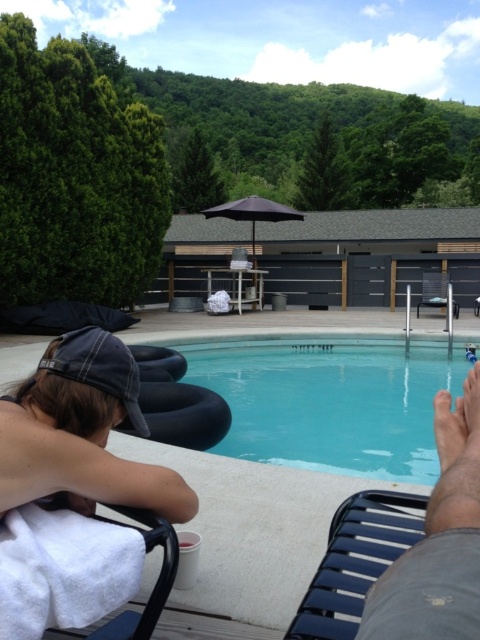
Question: Is black plastic chair at lower right wider than metallic silver chair at center?

Choices:
 (A) yes
 (B) no

Answer: (B)

Question: Observing the image, what is the correct spatial positioning of white fabric chair at lower left in reference to smooth skin foot at lower right?

Choices:
 (A) above
 (B) below

Answer: (B)

Question: Among these points, which one is farthest from the camera?

Choices:
 (A) (12, 451)
 (B) (332, 529)
 (C) (321, 333)

Answer: (C)

Question: Among these objects, which one is nearest to the camera?

Choices:
 (A) metallic silver chair at center
 (B) blue smooth water at center

Answer: (B)

Question: Does smooth tan skin at lower right appear on the right side of white fabric chair at lower left?

Choices:
 (A) no
 (B) yes

Answer: (B)

Question: Estimate the real-world distances between objects in this image. Which object is closer to the smooth tan skin at lower right?

Choices:
 (A) white towel at lower left
 (B) black plastic chair at lower right

Answer: (B)